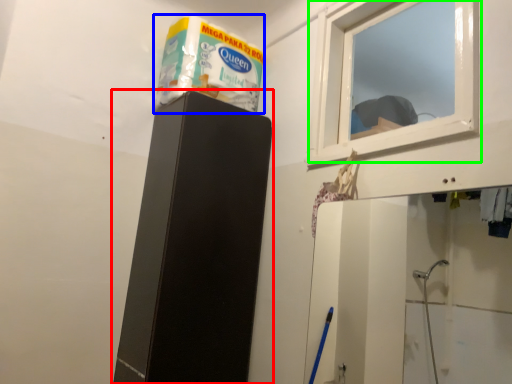
Question: Considering the real-world distances, which object is farthest from furniture (highlighted by a red box)? product (highlighted by a blue box) or window (highlighted by a green box)?

Choices:
 (A) product
 (B) window

Answer: (B)